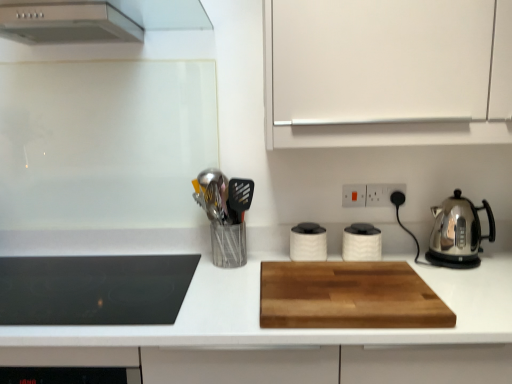
Question: From a real-world perspective, is wooden cutting board at center positioned over black plastic electric outlet at upper right, which is the 2th electric outlet from left to right, based on gravity?

Choices:
 (A) no
 (B) yes

Answer: (A)

Question: From the image's perspective, is wooden cutting board at center on top of black plastic electric outlet at upper right, which is the first electric outlet from right to left?

Choices:
 (A) yes
 (B) no

Answer: (B)

Question: From the image's perspective, is wooden cutting board at center located beneath black plastic electric outlet at upper right, which is the first electric outlet from right to left?

Choices:
 (A) no
 (B) yes

Answer: (B)

Question: Is wooden cutting board at center positioned with its back to black plastic electric outlet at upper right, which is the 2th electric outlet from left to right?

Choices:
 (A) yes
 (B) no

Answer: (B)

Question: Can you confirm if wooden cutting board at center is taller than black plastic electric outlet at upper right, which is the first electric outlet from right to left?

Choices:
 (A) yes
 (B) no

Answer: (A)

Question: Is wooden cutting board at center to the left of black plastic electric outlet at upper right, which is the first electric outlet from right to left, from the viewer's perspective?

Choices:
 (A) no
 (B) yes

Answer: (B)

Question: Considering the relative sizes of stainless steel kettle at right, the 4th kitchen appliance viewed from the left, and wooden cutting board at center in the image provided, is stainless steel kettle at right, the 4th kitchen appliance viewed from the left, shorter than wooden cutting board at center?

Choices:
 (A) no
 (B) yes

Answer: (A)

Question: Does stainless steel kettle at right, the 4th kitchen appliance viewed from the left, have a larger size compared to wooden cutting board at center?

Choices:
 (A) no
 (B) yes

Answer: (B)

Question: From a real-world perspective, is stainless steel kettle at right, the first kitchen appliance positioned from the right, below wooden cutting board at center?

Choices:
 (A) no
 (B) yes

Answer: (A)

Question: Is stainless steel kettle at right, the 4th kitchen appliance viewed from the left, not inside wooden cutting board at center?

Choices:
 (A) yes
 (B) no

Answer: (A)

Question: Is stainless steel kettle at right, the first kitchen appliance positioned from the right, closer to camera compared to wooden cutting board at center?

Choices:
 (A) no
 (B) yes

Answer: (A)

Question: Can you confirm if stainless steel kettle at right, the 4th kitchen appliance viewed from the left, is positioned to the right of wooden cutting board at center?

Choices:
 (A) yes
 (B) no

Answer: (A)

Question: Is white plastic electric outlet at upper center, positioned as the first electric outlet in left-to-right order, surrounded by wooden cutting board at center?

Choices:
 (A) yes
 (B) no

Answer: (B)